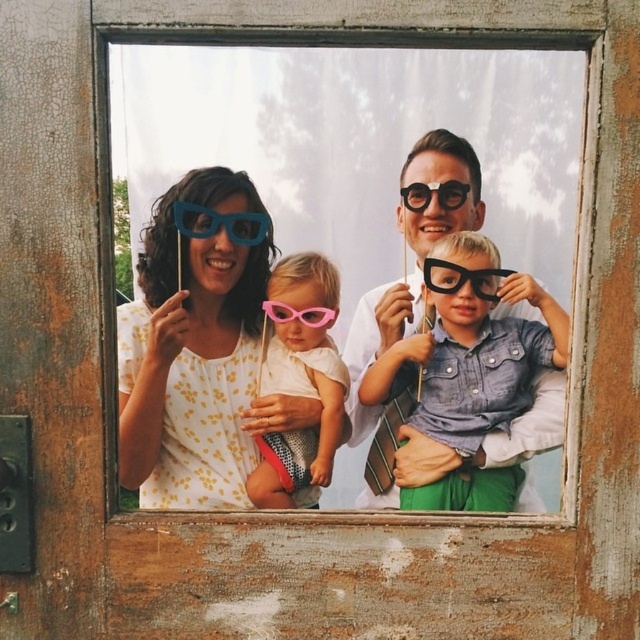
Question: Which object appears closest to the camera in this image?

Choices:
 (A) matte plastic glasses at center
 (B) blue matte glasses at upper left

Answer: (A)

Question: Does black matte sunglasses at right lie behind pink plastic goggles at center?

Choices:
 (A) yes
 (B) no

Answer: (B)

Question: Which point is farther to the camera?

Choices:
 (A) black matte sunglasses at right
 (B) pink plastic goggles at center
 (C) blue matte glasses at upper left

Answer: (B)

Question: Estimate the real-world distances between objects in this image. Which object is farther from the pink matte sunglasses at center?

Choices:
 (A) matte plastic glasses at center
 (B) black matte sunglasses at right
 (C) pink plastic goggles at center
 (D) matte black glasses at center

Answer: (D)

Question: Is black matte sunglasses at right wider than blue matte glasses at upper left?

Choices:
 (A) no
 (B) yes

Answer: (B)

Question: Where is black matte sunglasses at right located in relation to pink plastic goggles at center in the image?

Choices:
 (A) right
 (B) left

Answer: (A)